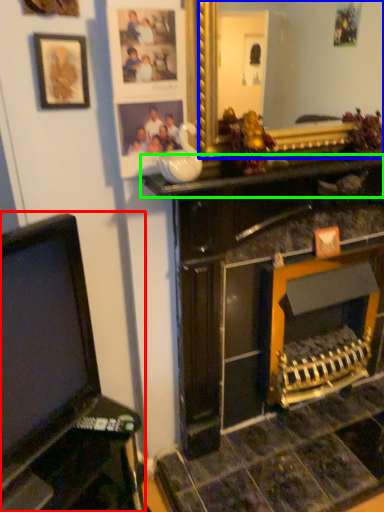
Question: Which object is the closest to the furniture (highlighted by a red box)? Choose among these: mirror (highlighted by a blue box) or counter top (highlighted by a green box).

Choices:
 (A) mirror
 (B) counter top

Answer: (B)